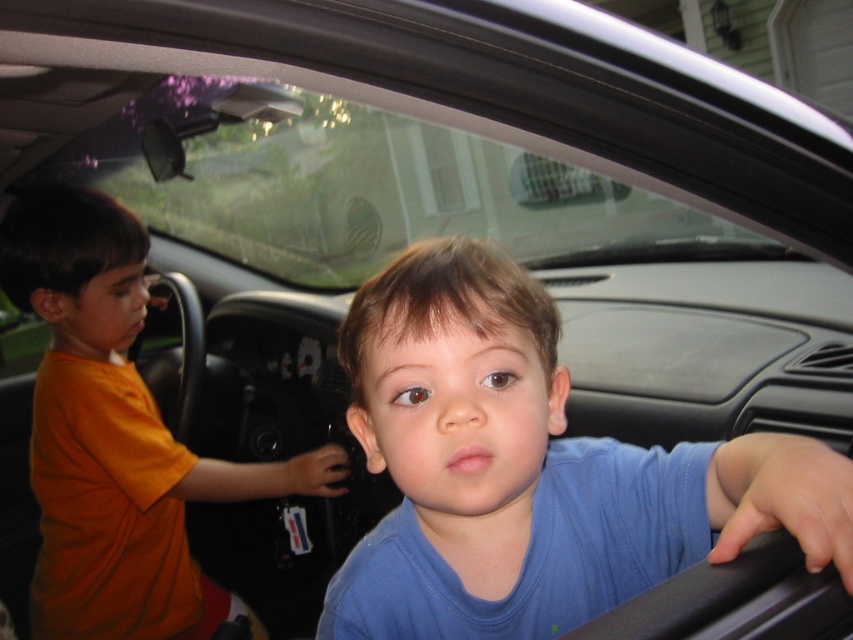
You are a delivery robot with a box that is 90 centimeters wide. You need to pass through the space between the transparent glass car window at upper center and the orange cotton shirt at left. Can your box fit through that space?

The distance between the transparent glass car window at upper center and the orange cotton shirt at left is 89.54 centimeters. Since your box is 90 centimeters wide, it is slightly wider than the available space. Therefore, the box cannot fit through that space.

Looking at this image, you are a delivery person trying to see the license plate of the car through the transparent glass car window at upper center. The blue matte shirt at center is blocking your view. Can you estimate whether the shirt is thin enough to see through it?

The blue matte shirt at center is thinner than the transparent glass car window at upper center, so it might be possible to see through the shirt to the license plate if the shirt material is translucent. However, the description only mentions the shirt is thinner, not necessarily transparent, so visibility may be limited depending on the fabric type.

You are a delivery person trying to see if there is a child in the car. You notice the transparent glass car window at upper center and the orange cotton shirt at left. Which object is wider?

The transparent glass car window at upper center is wider than the orange cotton shirt at left.